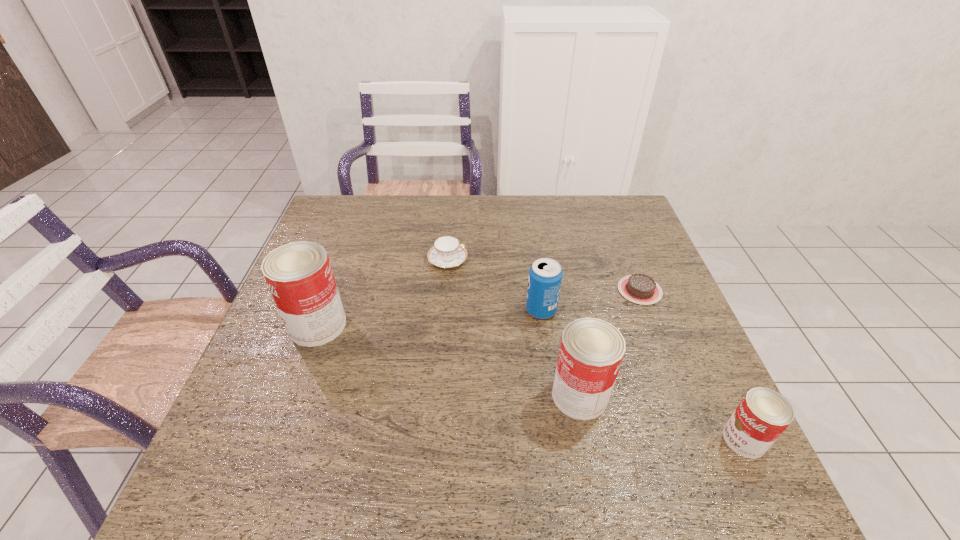
To achieve uniform spacing by inserting another can among them, please point to a free space for this new can. Please provide its 2D coordinates. Your answer should be formatted as a tuple, i.e. [(x, y)], where the tuple contains the x and y coordinates of a point satisfying the conditions above.

[(439, 357)]